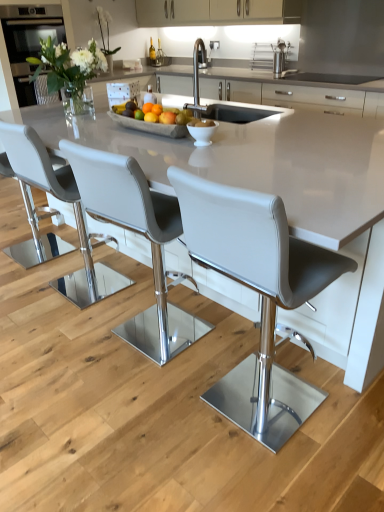
At what (x,y) coordinates should I click in order to perform the action: click on vacant space to the left of white leather chair at left, positioned as the 2th chair in left-to-right order. Please return your answer as a coordinate pair (x, y). Looking at the image, I should click on (26, 291).